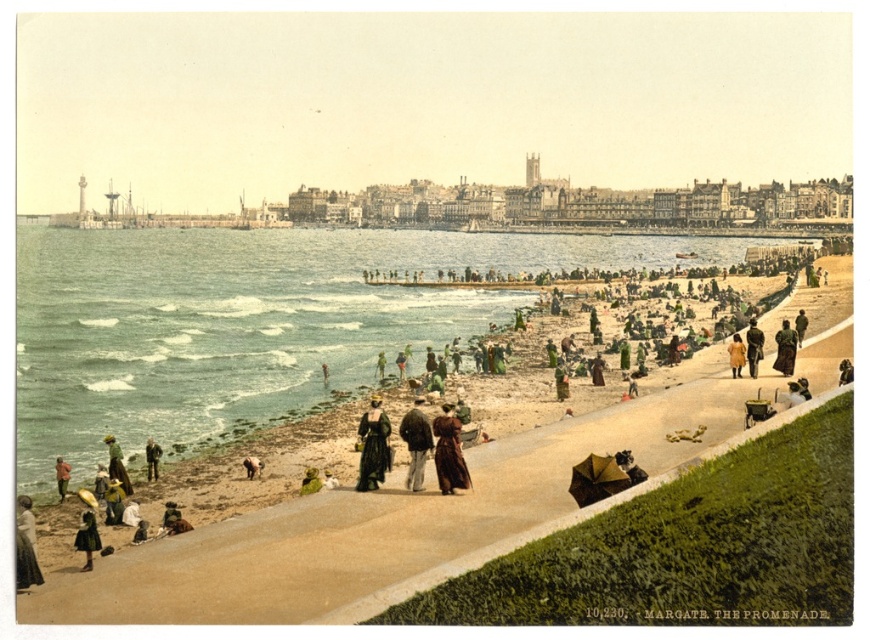
This screenshot has height=640, width=870. What do you see at coordinates (449, 452) in the screenshot?
I see `brown velvet coat at center` at bounding box center [449, 452].

Who is higher up, brown velvet coat at center or dark brown leather jacket at lower left?

Positioned higher is brown velvet coat at center.

Find the location of `brown velvet coat at center`. brown velvet coat at center is located at coordinates (449, 452).

Is black velvet dress at center to the right of yellow fabric dress at lower right from the viewer's perspective?

In fact, black velvet dress at center is to the left of yellow fabric dress at lower right.

Does black velvet dress at center have a larger size compared to yellow fabric dress at lower right?

Correct, black velvet dress at center is larger in size than yellow fabric dress at lower right.

Looking at this image, who is more forward, (x=385, y=467) or (x=735, y=352)?

Positioned in front is point (x=385, y=467).

What are the coordinates of `black velvet dress at center` in the screenshot? It's located at (373, 445).

Is brown velvet coat at center above brown wool coat at right?

Incorrect, brown velvet coat at center is not positioned above brown wool coat at right.

Based on the photo, can you confirm if brown velvet coat at center is thinner than brown wool coat at right?

Yes, brown velvet coat at center is thinner than brown wool coat at right.

You are a GUI agent. You are given a task and a screenshot of the screen. Output one action in this format:
    pyautogui.click(x=<x>, y=<y>)
    Task: Click on the brown velvet coat at center
    
    Given the screenshot: What is the action you would take?
    pyautogui.click(x=449, y=452)